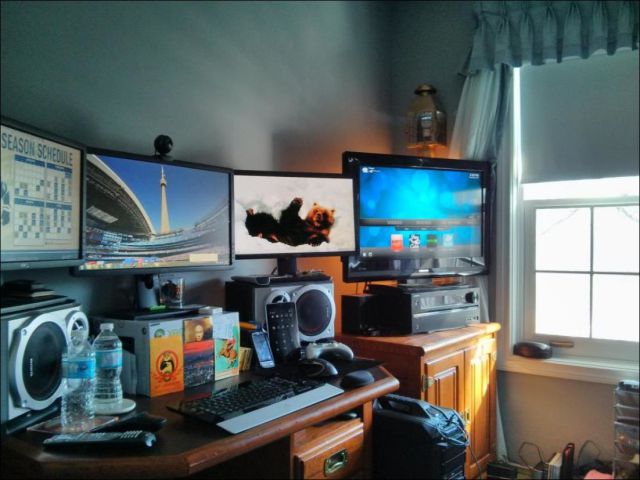
Locate an element on the screen. The width and height of the screenshot is (640, 480). window is located at coordinates (627, 252).